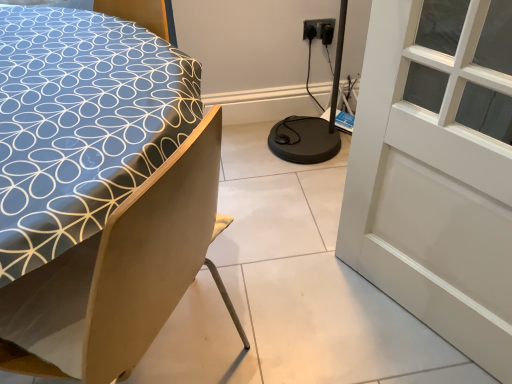
Question: Is black plastic electric outlet at upper right oriented towards blue fabric bed at left?

Choices:
 (A) no
 (B) yes

Answer: (A)

Question: From a real-world perspective, is black plastic electric outlet at upper right under blue fabric bed at left?

Choices:
 (A) yes
 (B) no

Answer: (B)

Question: Does black plastic electric outlet at upper right have a larger size compared to blue fabric bed at left?

Choices:
 (A) yes
 (B) no

Answer: (B)

Question: Is blue fabric bed at left a part of black plastic electric outlet at upper right?

Choices:
 (A) no
 (B) yes

Answer: (A)

Question: Would you consider black plastic electric outlet at upper right to be distant from blue fabric bed at left?

Choices:
 (A) yes
 (B) no

Answer: (A)

Question: Would you say black plastic electric outlet at upper right is outside blue fabric bed at left?

Choices:
 (A) no
 (B) yes

Answer: (B)

Question: Can you confirm if black plastic electric outlet at upper right is bigger than white glass window at upper right?

Choices:
 (A) yes
 (B) no

Answer: (B)

Question: Is black plastic electric outlet at upper right outside of white glass window at upper right?

Choices:
 (A) no
 (B) yes

Answer: (B)

Question: Is black plastic electric outlet at upper right positioned far away from white glass window at upper right?

Choices:
 (A) yes
 (B) no

Answer: (B)

Question: Can you confirm if black plastic electric outlet at upper right is positioned to the right of white glass window at upper right?

Choices:
 (A) yes
 (B) no

Answer: (B)

Question: Considering the relative sizes of black plastic electric outlet at upper right and white glass window at upper right in the image provided, is black plastic electric outlet at upper right taller than white glass window at upper right?

Choices:
 (A) yes
 (B) no

Answer: (B)

Question: From the image's perspective, would you say black plastic electric outlet at upper right is positioned over white glass window at upper right?

Choices:
 (A) no
 (B) yes

Answer: (B)

Question: Is blue fabric bed at left to the left of white glass window at upper right from the viewer's perspective?

Choices:
 (A) yes
 (B) no

Answer: (A)